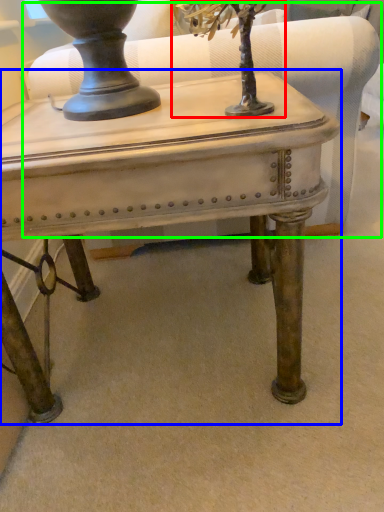
Question: Which object is positioned closest to tree (highlighted by a red box)? Select from table (highlighted by a blue box) and swivel chair (highlighted by a green box).

Choices:
 (A) table
 (B) swivel chair

Answer: (A)